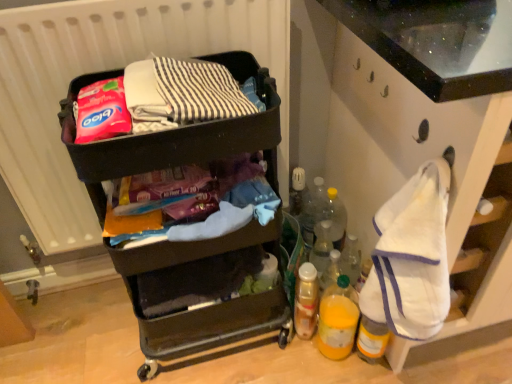
Where is `vacant space situated above black plastic cart at upper left (from a real-world perspective)`? vacant space situated above black plastic cart at upper left (from a real-world perspective) is located at coordinates (167, 88).